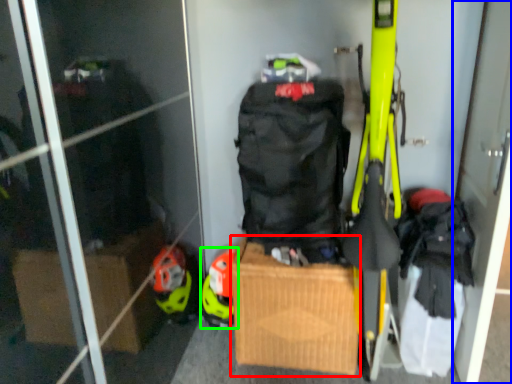
Question: Based on their relative distances, which object is farther from cardboard box (highlighted by a red box)? Choose from screen door (highlighted by a blue box) and helmet (highlighted by a green box).

Choices:
 (A) screen door
 (B) helmet

Answer: (A)